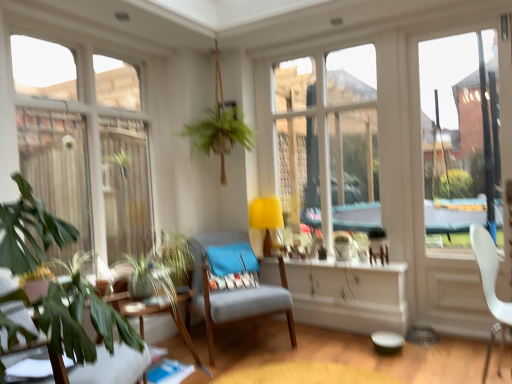
Question: From their relative heights in the image, would you say white plastic chair at right, the first chair in the right-to-left sequence, is taller or shorter than transparent glass window at left?

Choices:
 (A) tall
 (B) short

Answer: (B)

Question: From the image's perspective, relative to transparent glass window at left, is white plastic chair at right, acting as the second chair starting from the front, above or below?

Choices:
 (A) above
 (B) below

Answer: (B)

Question: Estimate the real-world distances between objects in this image. Which object is farther from the textured gray chair at center, the 2th chair from the left?

Choices:
 (A) white glossy window sill at center
 (B) white plastic chair at right, acting as the second chair starting from the front
 (C) yellow fabric lampshade at center
 (D) blue fabric pillow at center
 (E) green leafy plant at lower left

Answer: (B)

Question: Which object is the farthest from the blue fabric pillow at center?

Choices:
 (A) transparent glass door at right
 (B) white plastic chair at right, which is the 2th chair from back to front
 (C) white glossy window sill at center
 (D) green leafy plant at lower left, which is counted as the 1th chair, starting from the left
 (E) green leafy plant at lower left

Answer: (A)